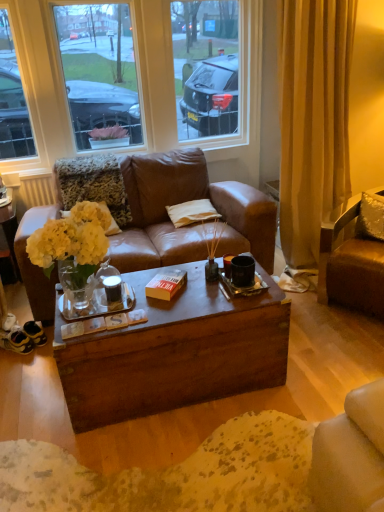
What do you see at coordinates (351, 267) in the screenshot?
I see `brown leather chair at right` at bounding box center [351, 267].

In order to click on orange matte book at center in this screenshot , I will do `click(166, 284)`.

Locate an element on the screen. The height and width of the screenshot is (512, 384). satin silver pillow at upper right, which ranks as the first pillow in right-to-left order is located at coordinates (371, 217).

What is the approximate width of satin silver pillow at upper right, placed as the second pillow when sorted from back to front?

The width of satin silver pillow at upper right, placed as the second pillow when sorted from back to front, is 8.82 inches.

At what (x,y) coordinates should I click in order to perform the action: click on yellow matte flowers at center. Please return your answer as a coordinate pair (x, y). Image resolution: width=384 pixels, height=512 pixels. Looking at the image, I should click on (72, 238).

Describe the element at coordinates (174, 90) in the screenshot. I see `clear glass window at upper center` at that location.

This screenshot has width=384, height=512. I want to click on brown leather chair at right, so click(351, 267).

From a real-world perspective, who is located lower, clear glass window at upper center or brown leather chair at right?

brown leather chair at right.

Does point (38, 34) appear closer or farther from the camera than point (323, 225)?

Point (38, 34).

How far apart are clear glass window at upper center and brown leather chair at right?

clear glass window at upper center is 1.56 meters away from brown leather chair at right.

From the image's perspective, is clear glass window at upper center positioned above or below brown leather chair at right?

clear glass window at upper center is situated higher than brown leather chair at right in the image.

From the yellow matte flowers at center, count 2nd pillow to the right and point to it. Please provide its 2D coordinates.

[(371, 217)]

In the image, is satin silver pillow at upper right, the 2th pillow when ordered from left to right, positioned in front of or behind yellow matte flowers at center?

satin silver pillow at upper right, the 2th pillow when ordered from left to right, is in front of yellow matte flowers at center.

Who is smaller, satin silver pillow at upper right, the 2th pillow when ordered from left to right, or yellow matte flowers at center?

satin silver pillow at upper right, the 2th pillow when ordered from left to right, is smaller.

From the image's perspective, is satin silver pillow at upper right, placed as the second pillow when sorted from back to front, below yellow matte flowers at center?

No, from the image's perspective, satin silver pillow at upper right, placed as the second pillow when sorted from back to front, is not beneath yellow matte flowers at center.

Do you think brown leather chair at right is within orange matte book at center, or outside of it?

brown leather chair at right is not enclosed by orange matte book at center.

Consider the image. From a real-world perspective, who is located higher, brown leather chair at right or orange matte book at center?

orange matte book at center.

Between brown leather chair at right and orange matte book at center, which one appears on the right side from the viewer's perspective?

Positioned to the right is brown leather chair at right.

Is clear glass window at upper center surrounding satin silver pillow at upper right, which ranks as the first pillow in right-to-left order?

No, satin silver pillow at upper right, which ranks as the first pillow in right-to-left order, is not surrounded by clear glass window at upper center.

Which of these two, clear glass window at upper center or satin silver pillow at upper right, which ranks as the first pillow in right-to-left order, is smaller?

Smaller between the two is satin silver pillow at upper right, which ranks as the first pillow in right-to-left order.

Is clear glass window at upper center aimed at satin silver pillow at upper right, which ranks as the first pillow in right-to-left order?

Yes.

Measure the distance between clear glass window at upper center and satin silver pillow at upper right, the 2th pillow when ordered from left to right.

1.44 meters.

From the image's perspective, which object appears higher, satin silver pillow at upper right, placed as the second pillow when sorted from back to front, or orange matte book at center?

satin silver pillow at upper right, placed as the second pillow when sorted from back to front, is shown above in the image.

Is satin silver pillow at upper right, which ranks as the first pillow in right-to-left order, inside the boundaries of orange matte book at center, or outside?

satin silver pillow at upper right, which ranks as the first pillow in right-to-left order, is located beyond the bounds of orange matte book at center.

Between satin silver pillow at upper right, which ranks as the first pillow in right-to-left order, and orange matte book at center, which one has smaller width?

→ With smaller width is orange matte book at center.

From the image's perspective, is orange matte book at center below satin silver pillow at upper right, placed as the second pillow when sorted from back to front?

Yes.

Which object is further away from the camera, orange matte book at center or satin silver pillow at upper right, placed as the second pillow when sorted from back to front?

satin silver pillow at upper right, placed as the second pillow when sorted from back to front, is further from the camera.

Is orange matte book at center outside of satin silver pillow at upper right, the 2th pillow when ordered from left to right?

That's correct, orange matte book at center is outside of satin silver pillow at upper right, the 2th pillow when ordered from left to right.

Is brown leather chair at right at the back of satin silver pillow at upper right, placed as the second pillow when sorted from back to front?

Absolutely, satin silver pillow at upper right, placed as the second pillow when sorted from back to front, is directed away from brown leather chair at right.

Is satin silver pillow at upper right, the first pillow in the front-to-back sequence, next to brown leather chair at right and touching it?

No, satin silver pillow at upper right, the first pillow in the front-to-back sequence, is not with brown leather chair at right.

From a real-world perspective, is satin silver pillow at upper right, the first pillow in the front-to-back sequence, positioned under brown leather chair at right based on gravity?

Actually, satin silver pillow at upper right, the first pillow in the front-to-back sequence, is physically above brown leather chair at right in the real world.

Which is behind, satin silver pillow at upper right, which ranks as the first pillow in right-to-left order, or brown leather chair at right?

satin silver pillow at upper right, which ranks as the first pillow in right-to-left order.

Locate an element on the screen. Image resolution: width=384 pixels, height=512 pixels. window that appears above the brown leather chair at right (from the image's perspective) is located at coordinates (174, 90).

Locate an element on the screen. The height and width of the screenshot is (512, 384). pillow lying in front of the yellow matte flowers at center is located at coordinates (371, 217).

Estimate the real-world distances between objects in this image. Which object is further from satin silver pillow at upper right, the 2th pillow when ordered from left to right, clear glass window at upper center or brown leather chair at right?

Among the two, clear glass window at upper center is located further to satin silver pillow at upper right, the 2th pillow when ordered from left to right.

Consider the image. Which object lies nearer to the anchor point orange matte book at center, satin silver pillow at upper right, placed as the second pillow when sorted from back to front, or yellow matte flowers at center?

Based on the image, yellow matte flowers at center appears to be nearer to orange matte book at center.

Based on their spatial positions, is yellow matte flowers at center or satin silver pillow at upper right, which ranks as the first pillow in right-to-left order, closer to orange matte book at center?

yellow matte flowers at center lies closer to orange matte book at center than the other object.

When comparing their distances from brown leather chair at right, does orange matte book at center or clear glass window at upper center seem further?

clear glass window at upper center is positioned further to the anchor brown leather chair at right.

Considering their positions, is yellow matte flowers at center positioned closer to clear glass window at upper center than orange matte book at center?

The object closer to clear glass window at upper center is orange matte book at center.

Looking at the image, which one is located further to yellow matte flowers at center, clear glass window at upper center or beige fabric pillow at center, the 1th pillow viewed from the back?

The object further to yellow matte flowers at center is clear glass window at upper center.

Which object lies further to the anchor point clear glass window at upper center, orange matte book at center or satin silver pillow at upper right, which ranks as the first pillow in right-to-left order?

The object further to clear glass window at upper center is orange matte book at center.

Based on their spatial positions, is clear glass window at upper center or orange matte book at center closer to brown leather chair at right?

Among the two, orange matte book at center is located nearer to brown leather chair at right.

The width and height of the screenshot is (384, 512). Find the location of `book between clear glass window at upper center and satin silver pillow at upper right, the 2th pillow when ordered from left to right, from left to right`. book between clear glass window at upper center and satin silver pillow at upper right, the 2th pillow when ordered from left to right, from left to right is located at coordinates (166, 284).

Locate an element on the screen. This screenshot has width=384, height=512. window between yellow matte flowers at center and brown leather chair at right is located at coordinates (174, 90).

You are a GUI agent. You are given a task and a screenshot of the screen. Output one action in this format:
    pyautogui.click(x=<x>, y=<y>)
    Task: Click on the pillow between orange matte book at center and brown leather chair at right from left to right
    
    Given the screenshot: What is the action you would take?
    pyautogui.click(x=192, y=212)

At what (x,y) coordinates should I click in order to perform the action: click on pillow located between clear glass window at upper center and brown leather chair at right in the left-right direction. Please return your answer as a coordinate pair (x, y). Looking at the image, I should click on (192, 212).